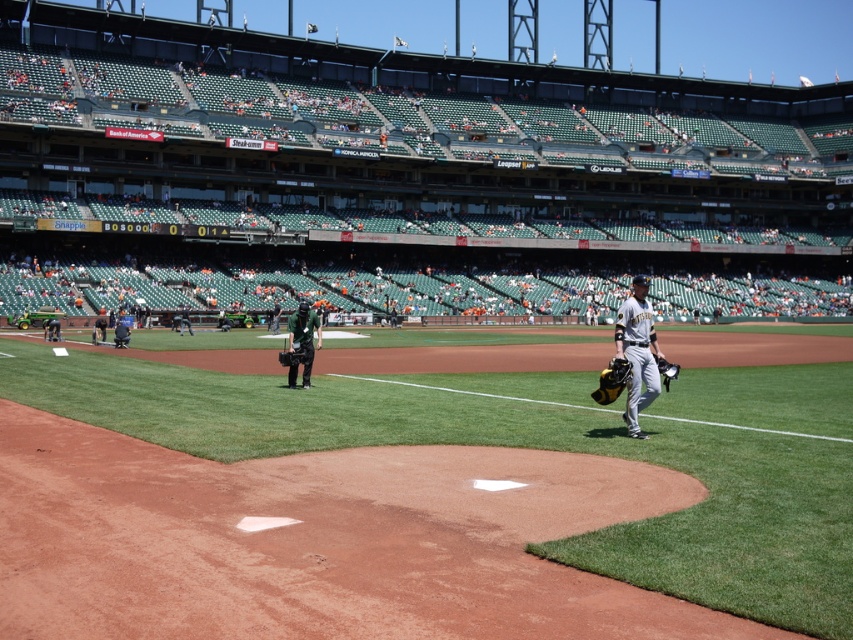
You are a photographer at the baseball stadium and need to capture a closeup shot of the gray matte uniform at center. The stadium seats are dark green and might interfere with the background. Where should you position yourself to ensure the uniform is centered in your shot without the dark green seats overlapping?

Position yourself directly in front of the gray matte uniform at center at coordinates point (405,176) to avoid the dark green seats and keep the uniform centered.

You are a photographer positioned at the edge of the field. You need to capture a photo that includes both the gray matte uniform at center and the gray uniformed baseball player at center. Which object should you pan your camera to the right to include in the frame first?

The gray matte uniform at center is to the right of the gray uniformed baseball player at center. Therefore, to include both in the frame, you should pan your camera to the right first to capture the gray uniformed baseball player at center before the gray matte uniform at center comes into view.

You are a photographer at the baseball field. You need to take a photo of both the gray matte uniform at center and the dark gray uniform at center. Which one should you focus on first if you want to capture them in order from left to right?

The dark gray uniform at center should be focused on first since it is positioned to the left of the gray matte uniform at center, making it the leftmost object in the scene.